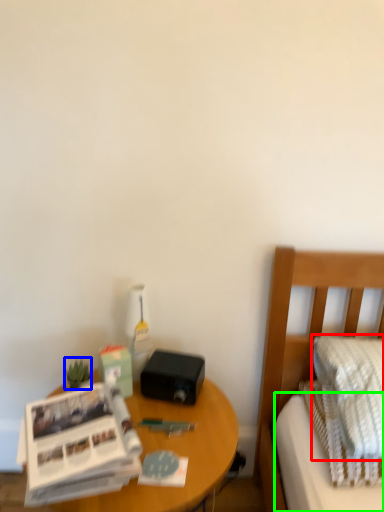
Question: Estimate the real-world distances between objects in this image. Which object is closer to pillow (highlighted by a red box), plant (highlighted by a blue box) or mattress (highlighted by a green box)?

Choices:
 (A) plant
 (B) mattress

Answer: (B)